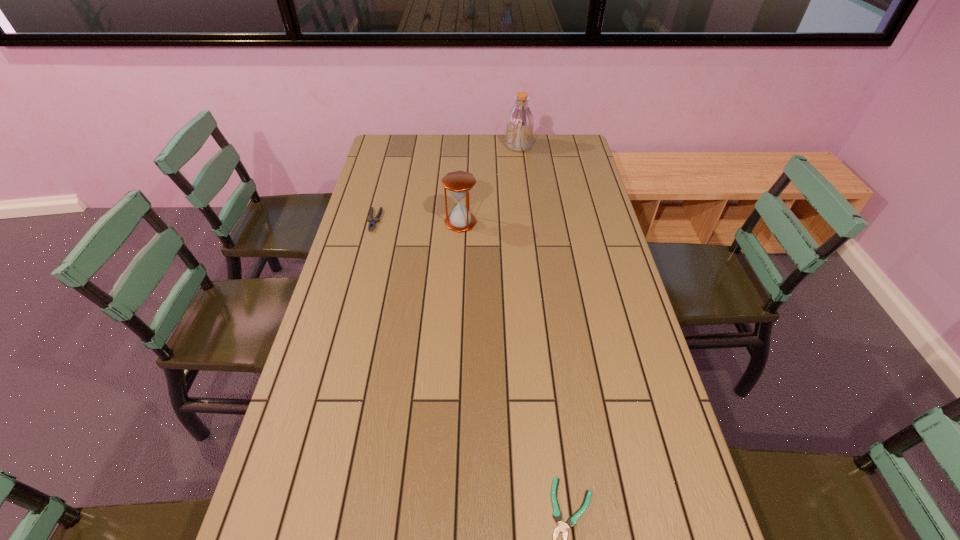
Where is `the farthest object`? This screenshot has height=540, width=960. the farthest object is located at coordinates (519, 130).

I want to click on the tallest object, so click(519, 130).

Locate an element on the screen. the second object from left to right is located at coordinates (459, 183).

Locate an element on the screen. The image size is (960, 540). the third shortest object is located at coordinates (459, 183).

The image size is (960, 540). I want to click on the second shortest object, so click(376, 219).

At what (x,y) coordinates should I click in order to perform the action: click on the taller pliers. Please return your answer as a coordinate pair (x, y). The height and width of the screenshot is (540, 960). Looking at the image, I should click on (376, 219).

Find the location of a particular element. This screenshot has width=960, height=540. vacant region located 0.200m on the left of the bottle is located at coordinates (460, 146).

I want to click on blank space located on the right of the third shortest object, so click(507, 222).

In order to click on vacant area situated 0.380m at the gripping part of the leftmost object in this screenshot , I will do `click(348, 318)`.

This screenshot has width=960, height=540. What are the coordinates of `object situated at the far edge` in the screenshot? It's located at (519, 130).